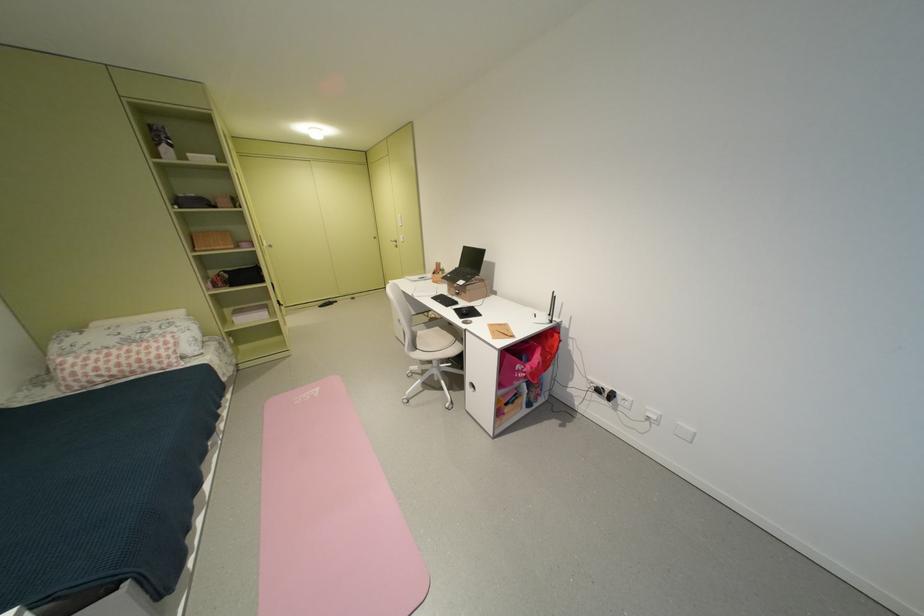
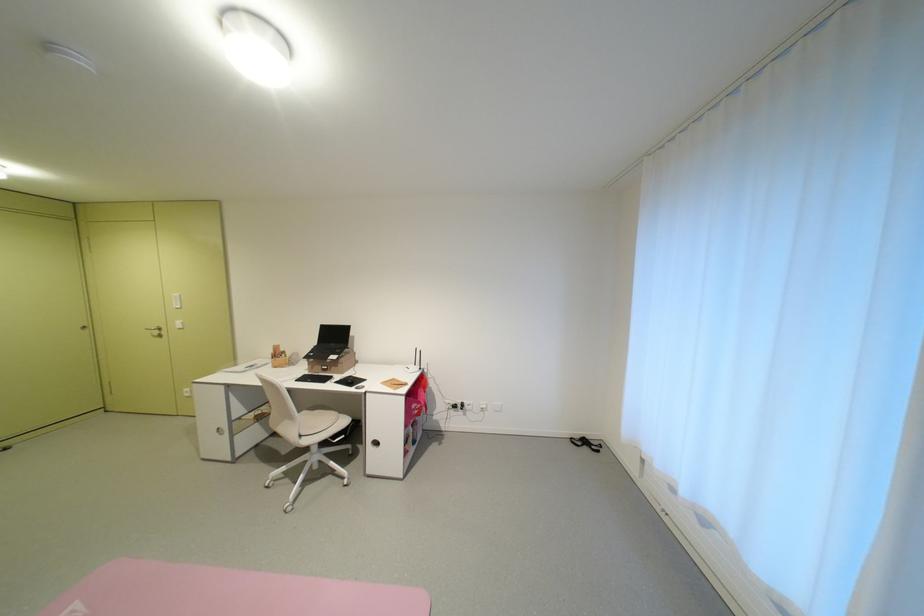
The point at [531,370] is marked in the first image. Where is the corresponding point in the second image?

(424, 408)